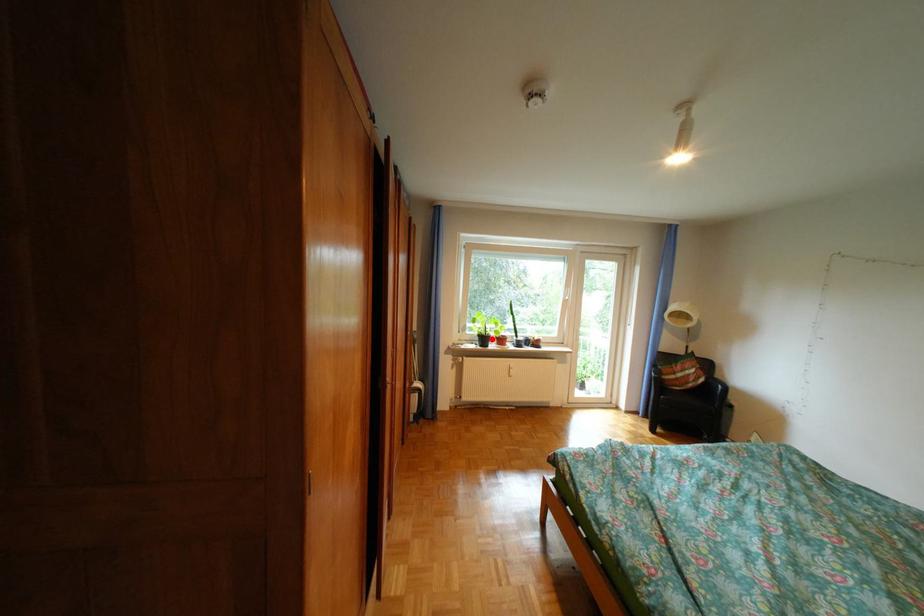
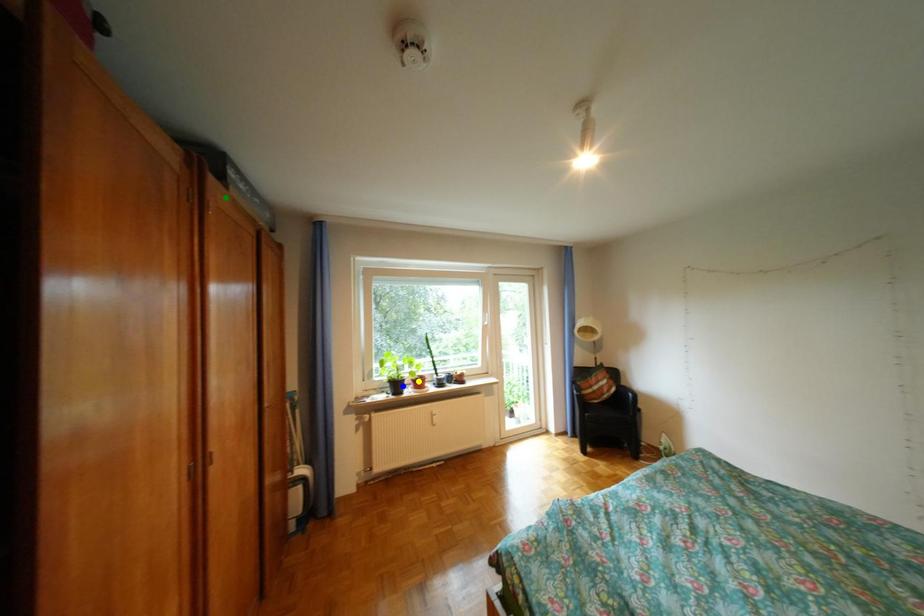
Question: I am providing you with two images of the same scene from different viewpoints. A red point is marked on the first image. You are given multiple points on the second image. Which mark in image 2 goes with the point in image 1?

Choices:
 (A) green point
 (B) yellow point
 (C) blue point

Answer: (C)